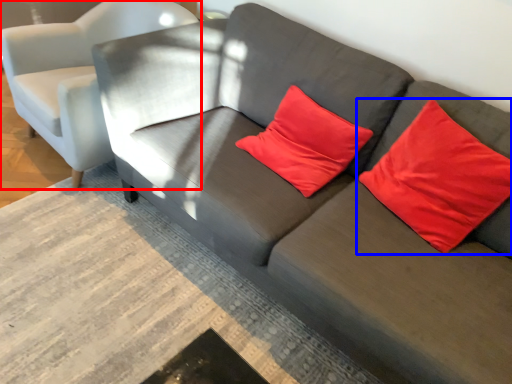
Question: Among these objects, which one is nearest to the camera, chair (highlighted by a red box) or pillow (highlighted by a blue box)?

Choices:
 (A) chair
 (B) pillow

Answer: (B)